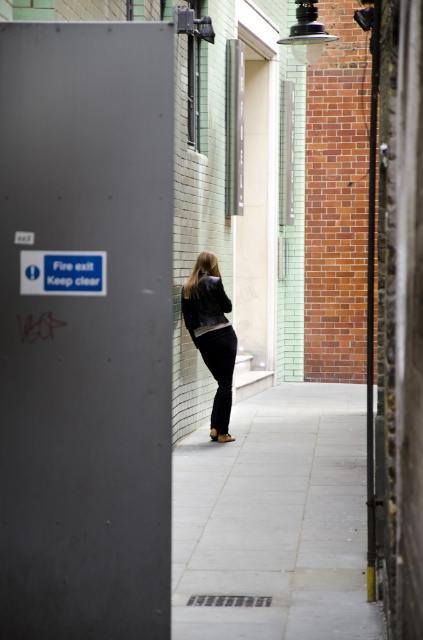
Can you confirm if gray concrete pavement at center is positioned to the right of matte black jacket at center?

Yes, gray concrete pavement at center is to the right of matte black jacket at center.

The height and width of the screenshot is (640, 423). I want to click on gray concrete pavement at center, so click(275, 518).